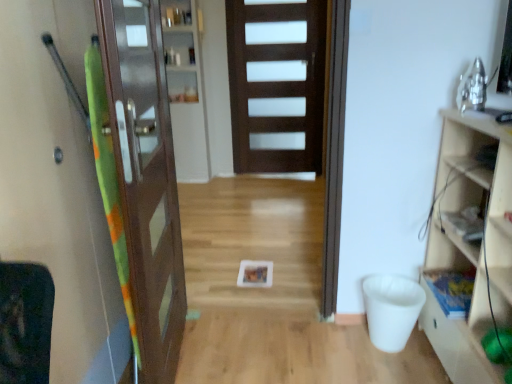
Question: Is clear glass cabinet at center, which ranks as the second shelf in front-to-back order, positioned with its back to green fabric screen door at left?

Choices:
 (A) yes
 (B) no

Answer: (B)

Question: Does clear glass cabinet at center, positioned as the 1th shelf in top-to-bottom order, have a greater width compared to green fabric screen door at left?

Choices:
 (A) yes
 (B) no

Answer: (B)

Question: From a real-world perspective, is clear glass cabinet at center, which ranks as the 2th shelf in bottom-to-top order, located beneath green fabric screen door at left?

Choices:
 (A) yes
 (B) no

Answer: (B)

Question: Is clear glass cabinet at center, positioned as the 1th shelf in top-to-bottom order, taller than green fabric screen door at left?

Choices:
 (A) no
 (B) yes

Answer: (B)

Question: From a real-world perspective, is clear glass cabinet at center, positioned as the 1th shelf in top-to-bottom order, positioned over green fabric screen door at left based on gravity?

Choices:
 (A) yes
 (B) no

Answer: (A)

Question: Visually, is green fabric screen door at left positioned to the left or to the right of clear glass cabinet at center, positioned as the 1th shelf in top-to-bottom order?

Choices:
 (A) right
 (B) left

Answer: (B)

Question: In terms of size, does green fabric screen door at left appear bigger or smaller than clear glass cabinet at center, which is counted as the 1th shelf, starting from the left?

Choices:
 (A) big
 (B) small

Answer: (A)

Question: In terms of height, does green fabric screen door at left look taller or shorter compared to clear glass cabinet at center, which ranks as the 2th shelf in bottom-to-top order?

Choices:
 (A) short
 (B) tall

Answer: (A)

Question: Is point (20, 228) closer or farther from the camera than point (174, 84)?

Choices:
 (A) farther
 (B) closer

Answer: (B)

Question: In terms of size, does brown wooden door at left, the 2th door in the back-to-front sequence, appear bigger or smaller than dark wood door at center, which is the second door from front to back?

Choices:
 (A) big
 (B) small

Answer: (B)

Question: From the image's perspective, is brown wooden door at left, which ranks as the 1th door in front-to-back order, located above or below dark wood door at center, which is the second door from front to back?

Choices:
 (A) below
 (B) above

Answer: (A)

Question: Relative to dark wood door at center, acting as the 1th door starting from the back, is brown wooden door at left, which ranks as the 1th door in front-to-back order, in front or behind?

Choices:
 (A) behind
 (B) front

Answer: (B)

Question: Choose the correct answer: Is brown wooden door at left, which ranks as the 2th door in right-to-left order, inside dark wood door at center, acting as the 2th door starting from the left, or outside it?

Choices:
 (A) inside
 (B) outside

Answer: (B)

Question: From a real-world perspective, relative to brown wooden door at left, the first door from the left, is wooden cabinet at right vertically above or below?

Choices:
 (A) above
 (B) below

Answer: (B)

Question: Relative to brown wooden door at left, which ranks as the 2th door in right-to-left order, is wooden cabinet at right in front or behind?

Choices:
 (A) behind
 (B) front

Answer: (A)